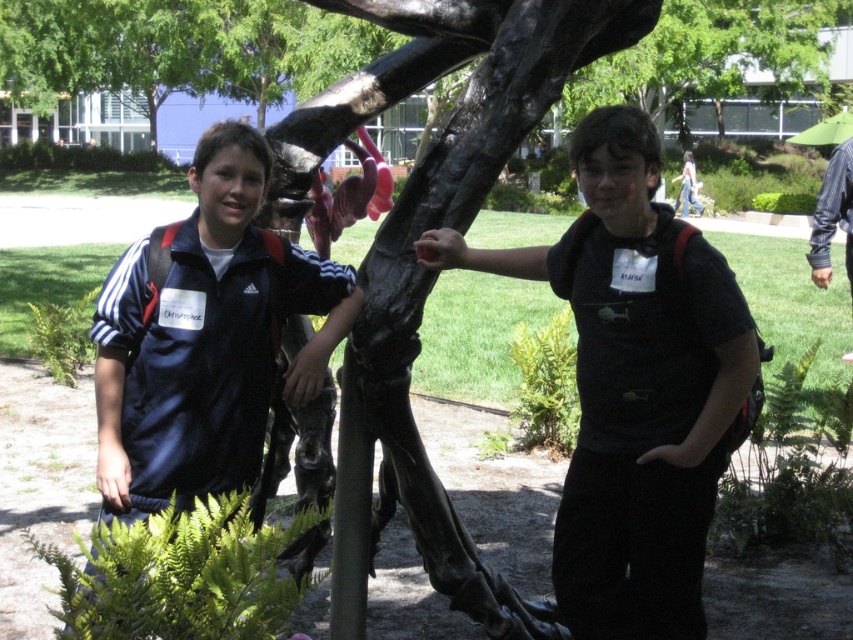
You are planning to carry both the matte black backpack at center and the dark blue fabric jacket at left. Which item can hold more items based on their sizes?

The matte black backpack at center has a larger size compared to the dark blue fabric jacket at left, so it can hold more items.

You are standing at the entrance of the sculpture garden and want to take a photo of the black polished tree trunk at center. Which direction should you face to ensure the tree trunk is in the center of your photo?

You should face the direction where the black polished tree trunk at center is located, which is at coordinates point (438, 221). Since the trunk is already at the center of the image, facing towards it will keep it centered in your photo.